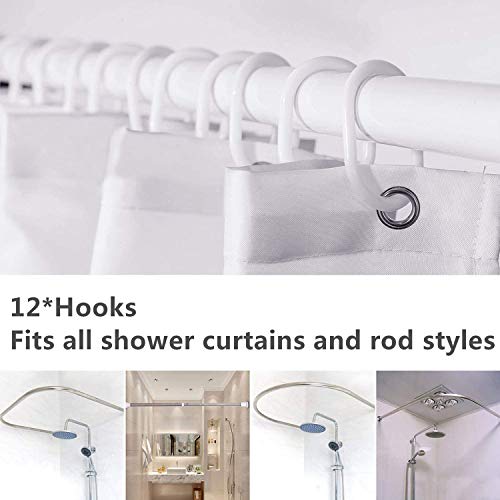
The height and width of the screenshot is (500, 500). I want to click on hook, so click(282, 143).